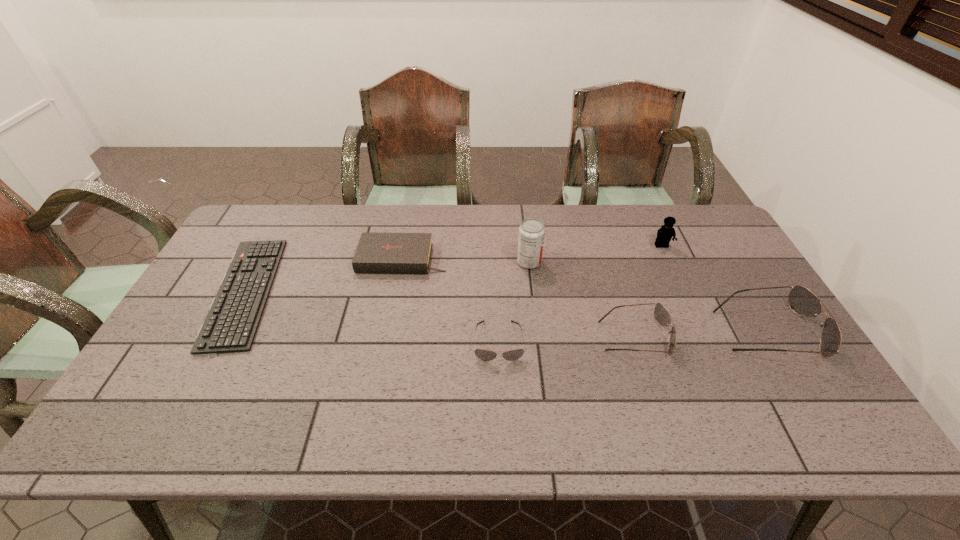
Find the location of a particular element. empty location between the Lego and the fifth object from left to right is located at coordinates (648, 291).

Identify the location of free area in between the second object from left to right and the rightmost object. (585, 295).

Identify the location of vacant space that's between the tallest object and the tallest sunglasses. The height and width of the screenshot is (540, 960). (648, 296).

Locate an element on the screen. The image size is (960, 540). empty space that is in between the third object from left to right and the sixth object from right to left is located at coordinates (450, 300).

This screenshot has height=540, width=960. Find the location of `free spot between the rightmost object and the fourth object from left to right`. free spot between the rightmost object and the fourth object from left to right is located at coordinates (648, 296).

This screenshot has height=540, width=960. Find the location of `vacant area between the tallest sunglasses and the Bible`. vacant area between the tallest sunglasses and the Bible is located at coordinates (585, 295).

Find the location of `empty location between the second tallest sunglasses and the shortest object`. empty location between the second tallest sunglasses and the shortest object is located at coordinates (440, 314).

This screenshot has height=540, width=960. Find the location of `free space between the second object from right to left and the tallest sunglasses`. free space between the second object from right to left and the tallest sunglasses is located at coordinates (714, 288).

Locate an element on the screen. This screenshot has height=540, width=960. vacant space that is in between the fifth object from left to right and the tallest object is located at coordinates (582, 299).

The width and height of the screenshot is (960, 540). What are the coordinates of `vacant area that lies between the fifth object from left to right and the rightmost object` in the screenshot? It's located at (701, 334).